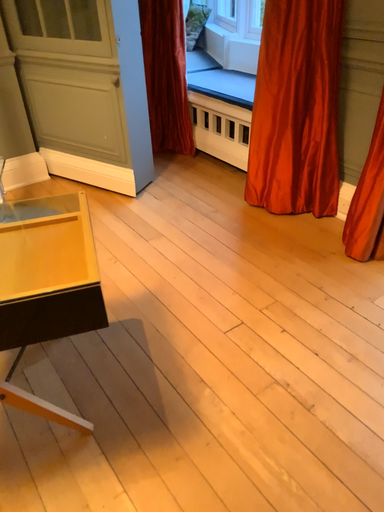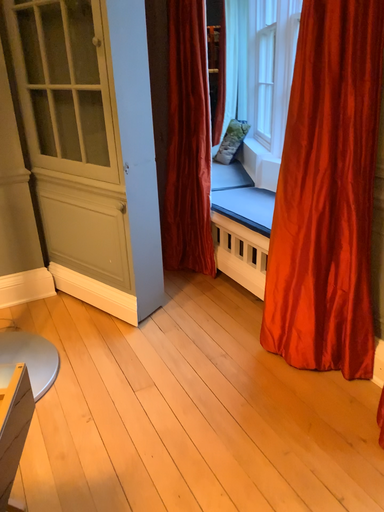
Question: How did the camera likely rotate when shooting the video?

Choices:
 (A) rotated downward
 (B) rotated upward

Answer: (B)